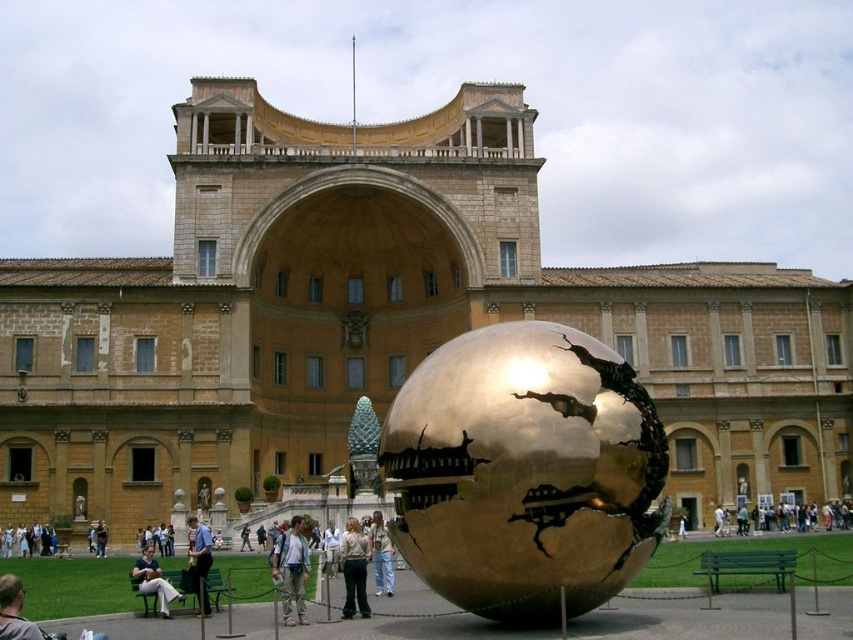
Question: Which point is closer to the camera?

Choices:
 (A) light brown leather jacket at lower left
 (B) khaki cotton pants at center
 (C) light blue denim jeans at center

Answer: (A)

Question: Which point appears closest to the camera in this image?

Choices:
 (A) (292, 577)
 (B) (763, 522)

Answer: (A)

Question: Can you confirm if light brown leather jacket at lower left is wider than light brown wooden bench at lower center?

Choices:
 (A) yes
 (B) no

Answer: (A)

Question: Does khaki cotton pants at center appear on the left side of light brown leather jacket at lower left?

Choices:
 (A) yes
 (B) no

Answer: (B)

Question: Does light blue jeans at center appear on the left side of light brown leather jacket at lower left?

Choices:
 (A) no
 (B) yes

Answer: (A)

Question: Which object appears closest to the camera in this image?

Choices:
 (A) light brown leather jacket at center
 (B) light beige pants at lower left
 (C) light blue jeans at center
 (D) khaki cotton pants at center

Answer: (C)